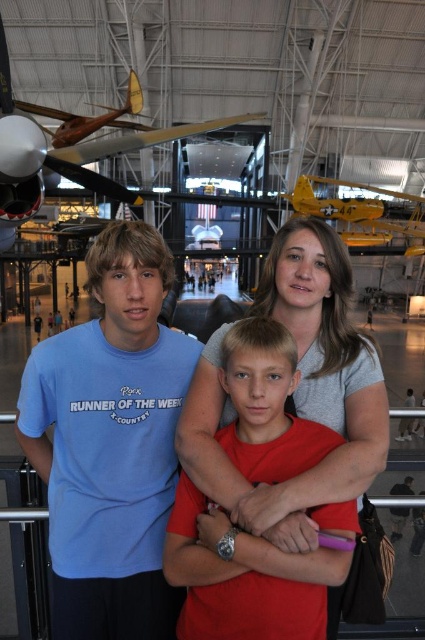
You are a photographer trying to capture a photo of the matte red shirt at center and the yellow matte airplane at upper center. Which object is positioned higher in the image?

The yellow matte airplane at upper center is positioned higher than the matte red shirt at center.

You are a photographer trying to capture a photo of the matte red shirt at center and the wooden propeller plane at upper left. Which object would appear smaller in your camera viewfinder?

The matte red shirt at center would appear smaller in the camera viewfinder because it has a smaller size compared to the wooden propeller plane at upper left.